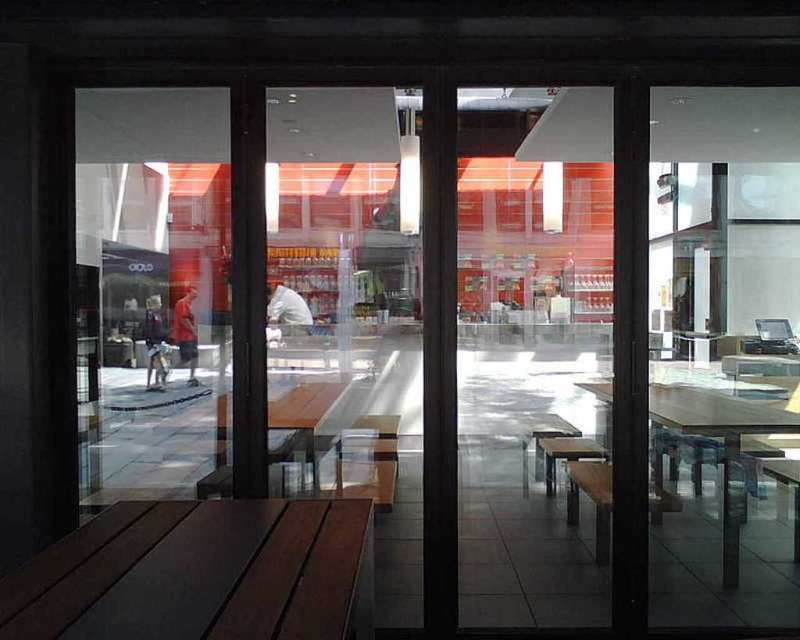
Measure the distance between brown wood table at lower left and camera.

brown wood table at lower left and camera are 4.67 feet apart from each other.

Who is positioned more to the right, brown wood table at lower left or wooden table at center?

wooden table at center is more to the right.

Image resolution: width=800 pixels, height=640 pixels. I want to click on brown wood table at lower left, so click(x=200, y=573).

Consider the image. Is transparent glass screen door at left closer to camera compared to brown wood table at lower left?

No, transparent glass screen door at left is behind brown wood table at lower left.

Does transparent glass screen door at left appear under brown wood table at lower left?

Incorrect, transparent glass screen door at left is not positioned below brown wood table at lower left.

Which is in front, point (188, 413) or point (222, 612)?

Point (222, 612) is more forward.

Identify the location of transparent glass screen door at left. (150, 291).

Does point (502, 236) come farther from viewer compared to point (762, 432)?

No, (502, 236) is closer to viewer.

Which is behind, point (570, 259) or point (740, 522)?

The point (740, 522) is behind.

The width and height of the screenshot is (800, 640). Identify the location of transparent glass screen door at center. (533, 353).